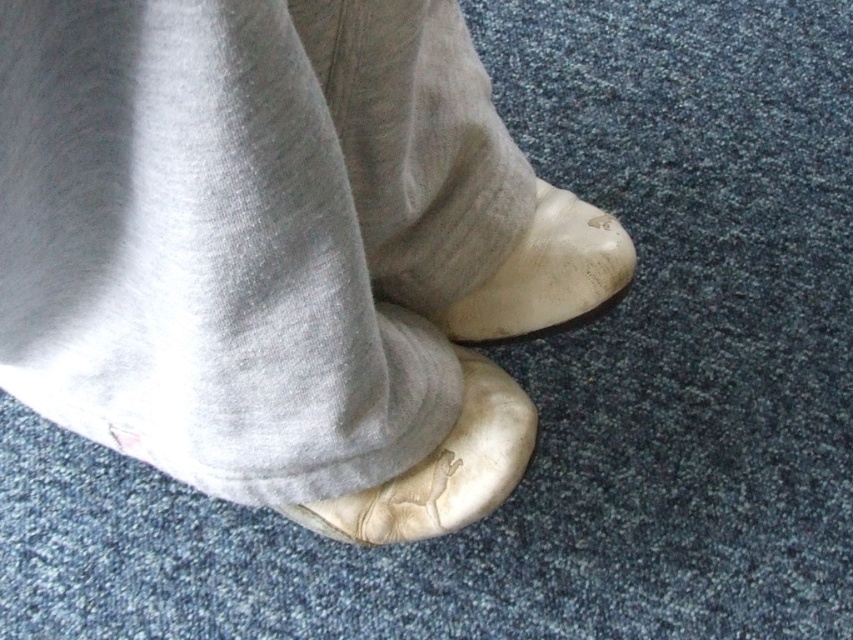
Question: Which point is closer to the camera taking this photo?

Choices:
 (A) (390, 540)
 (B) (103, 68)
 (C) (381, 60)
 (D) (430, 320)

Answer: (B)

Question: Can you confirm if gray cotton sock at center is positioned to the left of leather shoe at lower center?

Choices:
 (A) no
 (B) yes

Answer: (A)

Question: Which object is positioned closest to the gray cotton sock at center?

Choices:
 (A) leather shoe at lower center
 (B) leather slipper at center
 (C) leather shoe at center

Answer: (B)

Question: Does leather slipper at center appear under leather shoe at center?

Choices:
 (A) yes
 (B) no

Answer: (A)

Question: Which point is closer to the camera?

Choices:
 (A) (241, 321)
 (B) (450, 209)
 (C) (479, 376)
 (D) (564, 196)

Answer: (A)

Question: Does gray cotton sock at center appear on the left side of leather shoe at lower center?

Choices:
 (A) yes
 (B) no

Answer: (B)